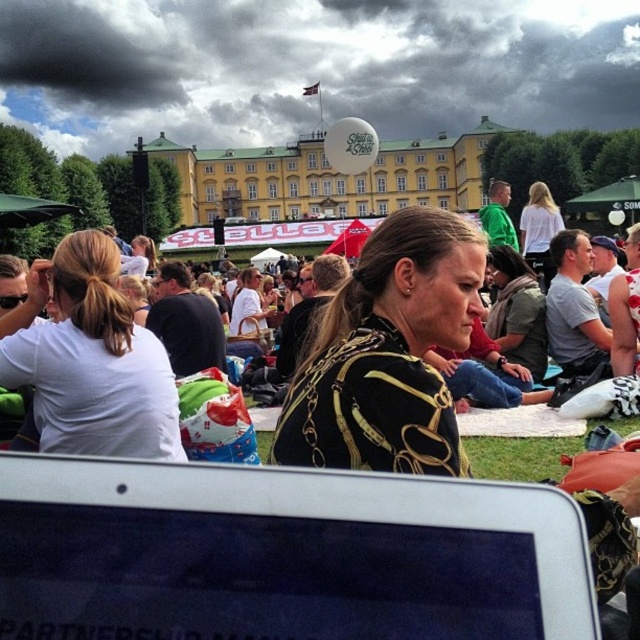
Question: Which point is closer to the camera?

Choices:
 (A) black textured jacket at center
 (B) silver metallic tablet at lower center

Answer: (B)

Question: Is black textured jacket at center wider than white matte shirt at upper right?

Choices:
 (A) no
 (B) yes

Answer: (B)

Question: Which point is closer to the camera?

Choices:
 (A) (493, 248)
 (B) (540, 228)

Answer: (A)

Question: Which of the following is the closest to the observer?

Choices:
 (A) (492, 449)
 (B) (364, 326)
 (C) (541, 342)

Answer: (B)

Question: Does black leather jacket at center appear under green grass at lower center?

Choices:
 (A) yes
 (B) no

Answer: (B)

Question: Is black leather jacket at center bigger than green grass at lower center?

Choices:
 (A) no
 (B) yes

Answer: (B)